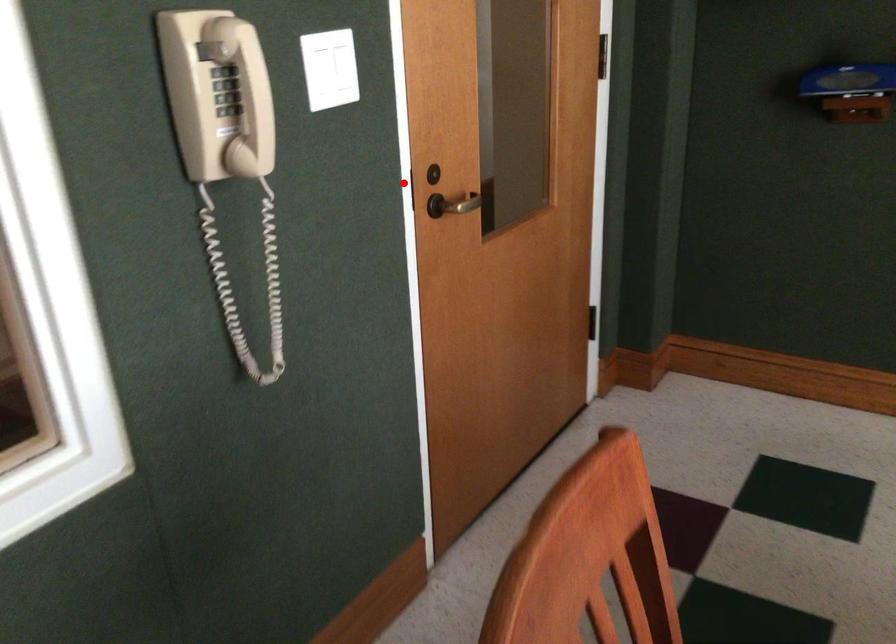
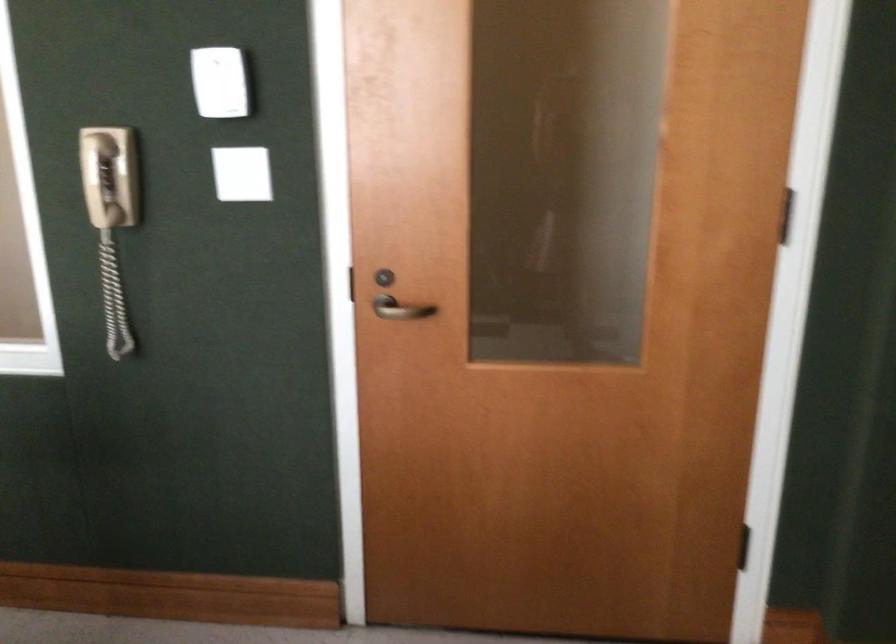
Find the pixel in the second image that matches the highlighted location in the first image.

(346, 283)